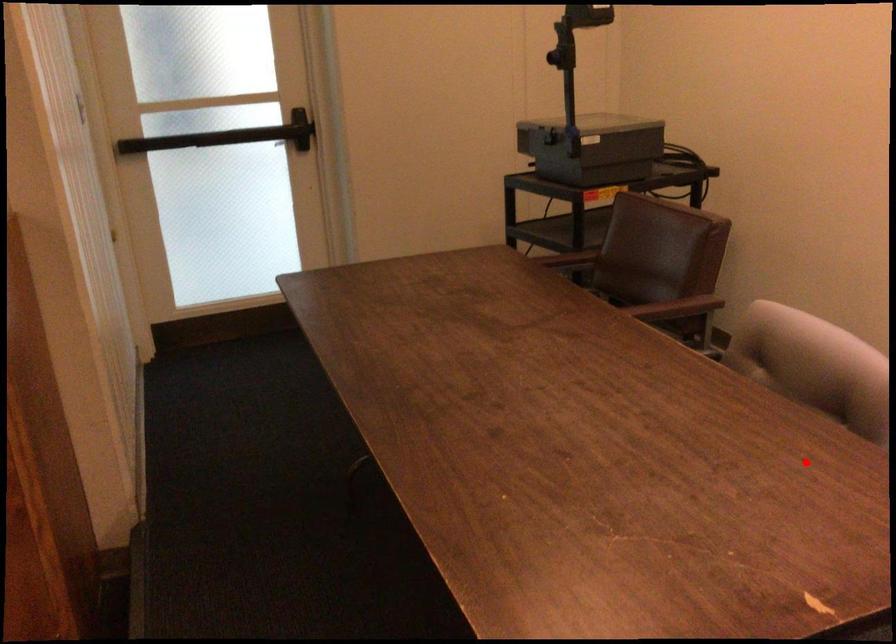
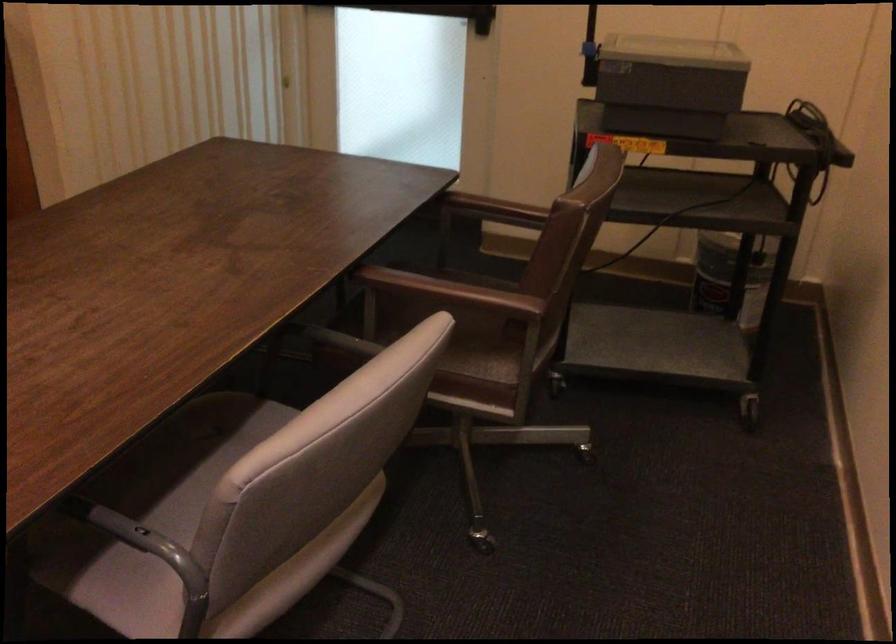
Question: I am providing you with two images of the same scene from different viewpoints. A red point is shown in image1. For the corresponding object point in image2, is it positioned nearer or farther from the camera?

Choices:
 (A) Nearer
 (B) Farther

Answer: (A)